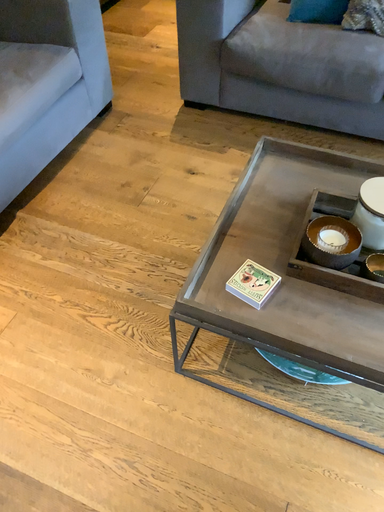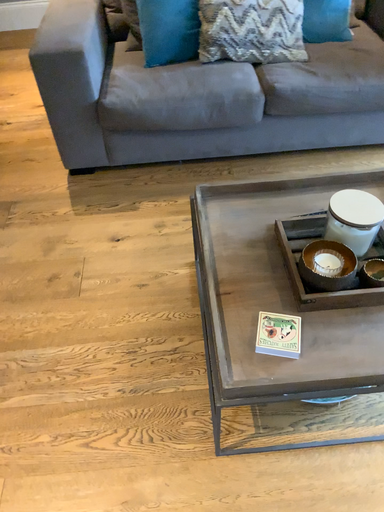
Question: How did the camera likely rotate when shooting the video?

Choices:
 (A) rotated upward
 (B) rotated downward

Answer: (A)